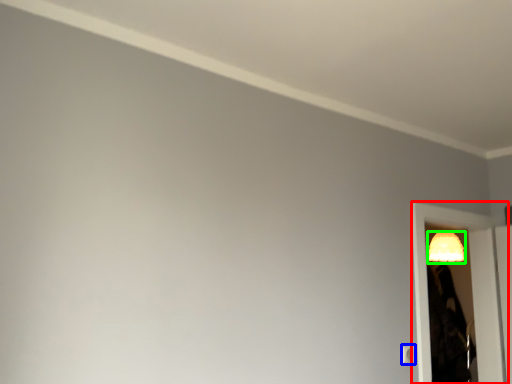
Question: Considering the real-world distances, which object is farthest from screen door (highlighted by a red box)? light switch (highlighted by a blue box) or lamp (highlighted by a green box)?

Choices:
 (A) light switch
 (B) lamp

Answer: (A)